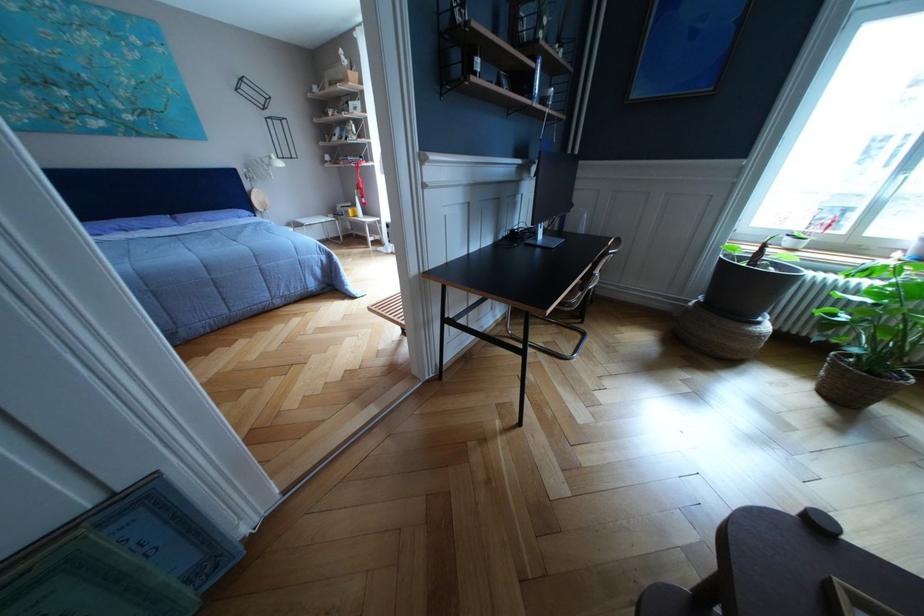
The height and width of the screenshot is (616, 924). Describe the element at coordinates (827, 527) in the screenshot. I see `a metal chair armrest` at that location.